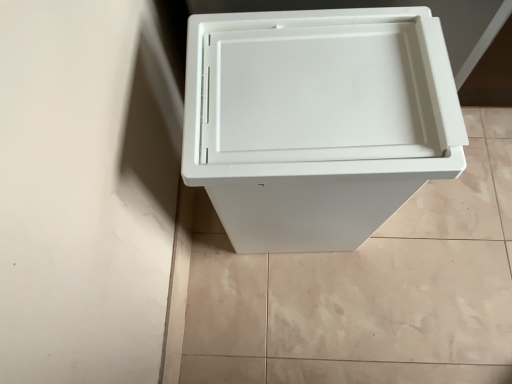
The height and width of the screenshot is (384, 512). Describe the element at coordinates (317, 121) in the screenshot. I see `white plastic waste container at center` at that location.

The image size is (512, 384). Identify the location of white plastic waste container at center. (317, 121).

Locate an element on the screen. Image resolution: width=512 pixels, height=384 pixels. white plastic waste container at center is located at coordinates (317, 121).